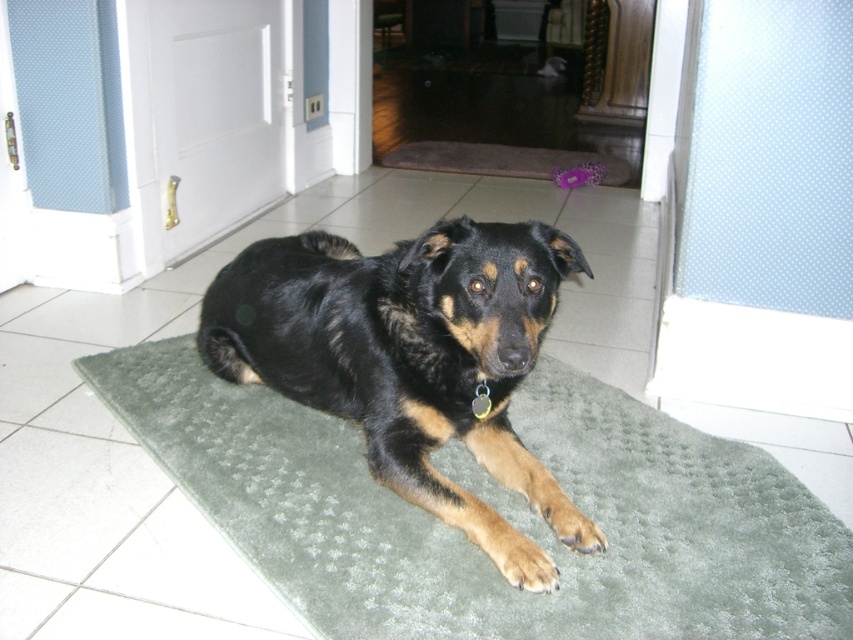
Question: Does black fur dog at center appear under brown textured mat at center?

Choices:
 (A) yes
 (B) no

Answer: (A)

Question: Can you confirm if green textured mat at center is bigger than black fur dog at center?

Choices:
 (A) yes
 (B) no

Answer: (A)

Question: Does green textured mat at center have a lesser width compared to black fur dog at center?

Choices:
 (A) yes
 (B) no

Answer: (B)

Question: Which point is closer to the camera taking this photo?

Choices:
 (A) (210, 365)
 (B) (637, 445)

Answer: (B)

Question: Among these points, which one is farthest from the camera?

Choices:
 (A) (606, 387)
 (B) (585, 536)

Answer: (A)

Question: Estimate the real-world distances between objects in this image. Which object is farther from the green textured mat at center?

Choices:
 (A) black fur dog at center
 (B) brown textured mat at center

Answer: (B)